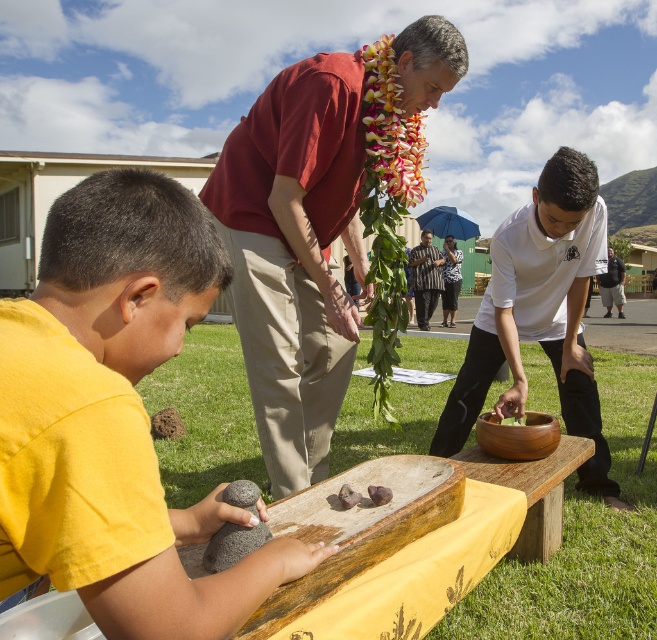
Looking at this image, you are a photographer standing in front of the scene. You want to take a photo of the pink floral lei at center without the smooth wood bowl at lower center appearing in the foreground. Is the position of the lei above or below the bowl?

The pink floral lei at center is positioned above the smooth wood bowl at lower center, so if you angle your camera to avoid the bowl, you can capture the lei without it appearing in the foreground.

You are a photographer positioned at the center of the scene. You want to capture a photo that includes both the yellow matte shirt at lower left and the pink floral lei at center. Based on their positions, which object should you adjust your camera angle to focus on first to ensure both are in frame?

The yellow matte shirt at lower left is to the left of the pink floral lei at center, so you should adjust your camera angle to focus on the yellow matte shirt at lower left first to ensure both are in frame.

You are a photographer standing at the position of the brown rough rock at lower left. You want to take a photo of the pink floral lei at center without moving. Can you reach it with your camera lens that has a maximum zoom of 2 meters?

The distance between the pink floral lei at center and brown rough rock at lower left is 2.79 meters, which exceeds the camera lens maximum zoom of 2 meters. Therefore, you cannot capture the pink floral lei at center without moving closer.